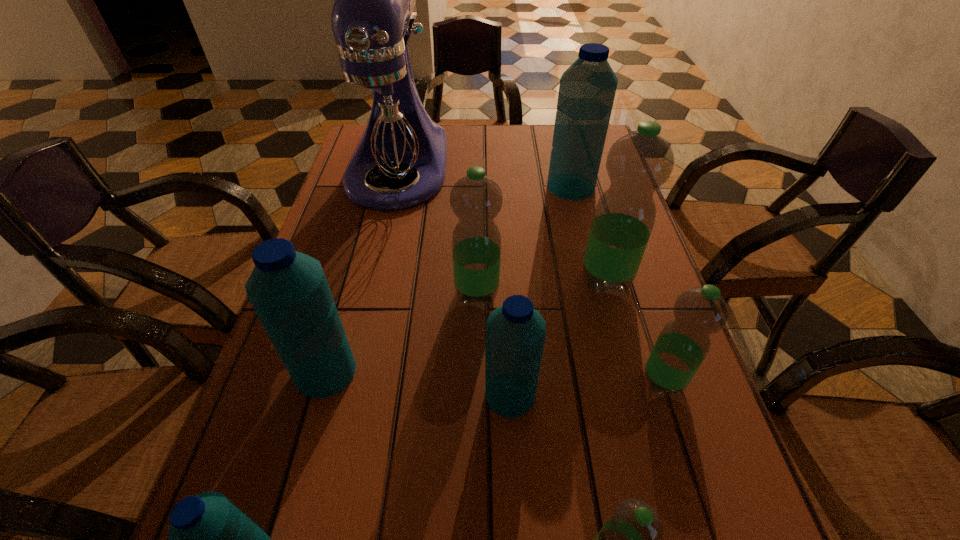
At what (x,y) coordinates should I click in order to perform the action: click on free space located 0.310m on the left of the rightmost blue water bottle. Please return your answer as a coordinate pair (x, y). Looking at the image, I should click on (435, 186).

I want to click on free region located on the back of the biggest green water bottle, so click(x=575, y=166).

Locate an element on the screen. Image resolution: width=960 pixels, height=540 pixels. blank space located on the right of the second biggest green water bottle is located at coordinates (560, 293).

Locate an element on the screen. The image size is (960, 540). free region located on the front of the third smallest blue water bottle is located at coordinates (307, 437).

Identify the location of vacant space situated on the front of the second smallest green water bottle. (688, 457).

Find the location of a particular element. The width and height of the screenshot is (960, 540). vacant space situated on the front of the second smallest blue water bottle is located at coordinates (516, 494).

The height and width of the screenshot is (540, 960). Find the location of `object positioned at the far edge`. object positioned at the far edge is located at coordinates (382, 119).

Where is `mixer located at the left edge`? mixer located at the left edge is located at coordinates (382, 119).

I want to click on water bottle located in the left edge section of the desktop, so click(x=288, y=290).

In order to click on object that is at the far left corner in this screenshot , I will do `click(382, 119)`.